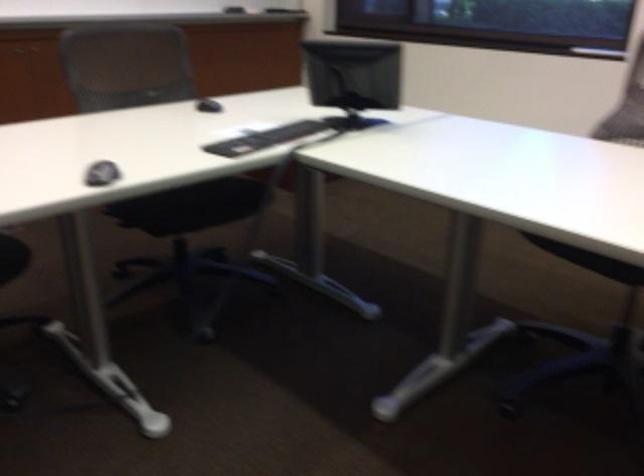
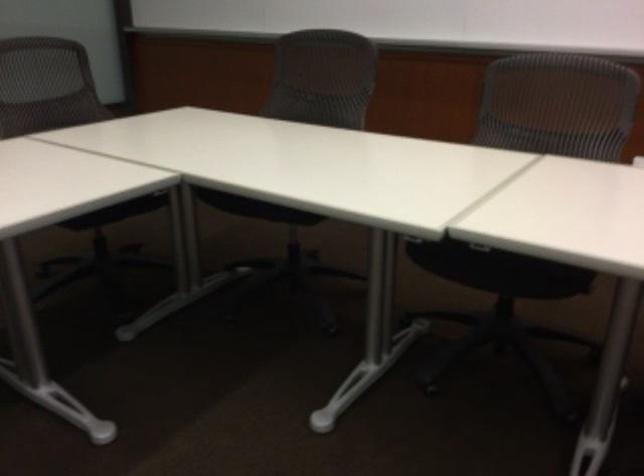
Question: The camera is either moving clockwise (left) or counter-clockwise (right) around the object. The first image is from the beginning of the video and the second image is from the end. Is the camera moving left or right when shooting the video?

Choices:
 (A) Left
 (B) Right

Answer: (B)